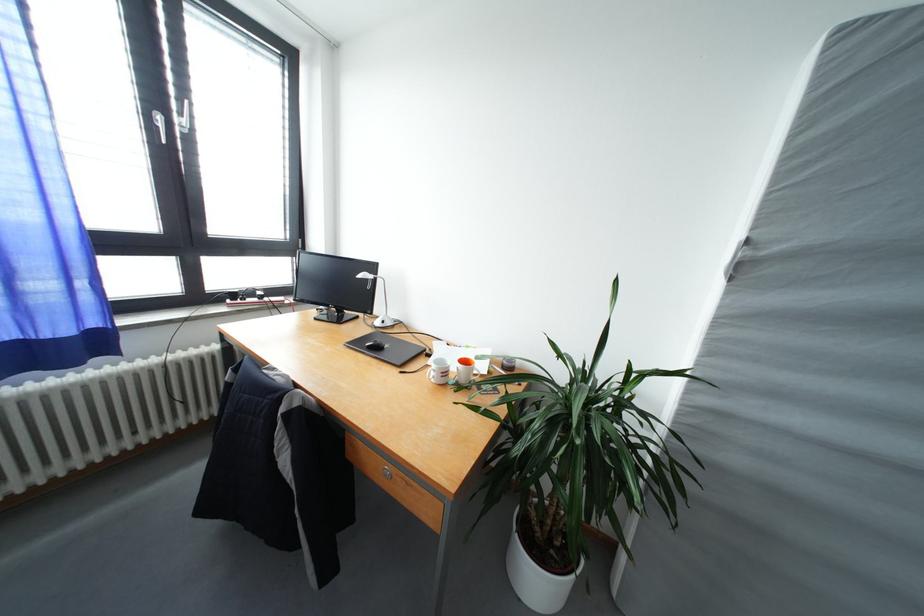
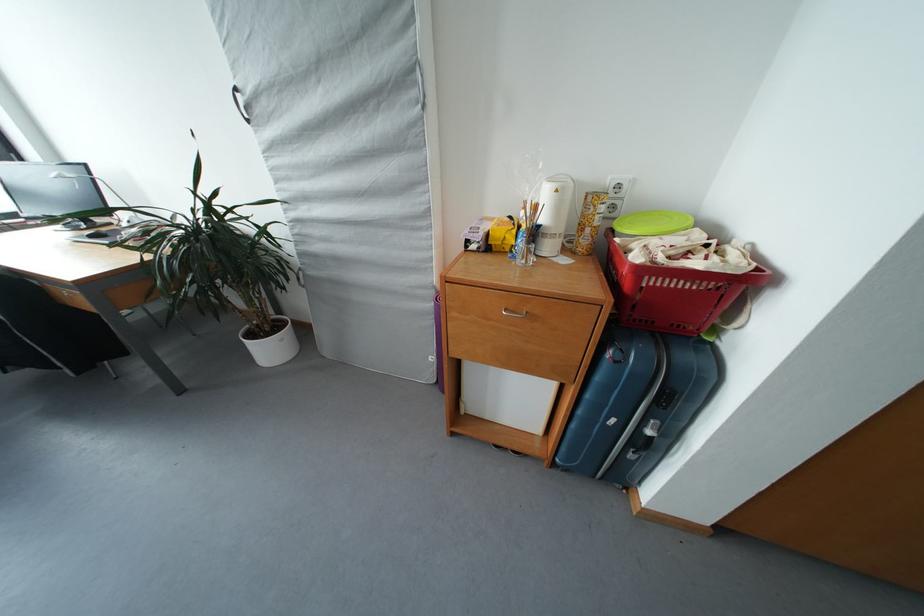
Which direction would the cameraman need to move to produce the second image?

The cameraman walked toward right, backward.